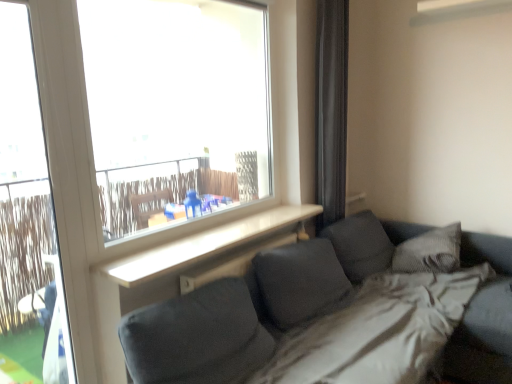
Question: Is point (37, 97) closer or farther from the camera than point (325, 170)?

Choices:
 (A) closer
 (B) farther

Answer: (A)

Question: In terms of height, does white plastic screen door at left look taller or shorter compared to black fabric curtain at right?

Choices:
 (A) short
 (B) tall

Answer: (B)

Question: Which object is the closest to the textured gray pillow at right?

Choices:
 (A) black fabric curtain at right
 (B) white plastic screen door at left

Answer: (A)

Question: Which is nearer to the textured gray pillow at right?

Choices:
 (A) white plastic screen door at left
 (B) black fabric curtain at right

Answer: (B)